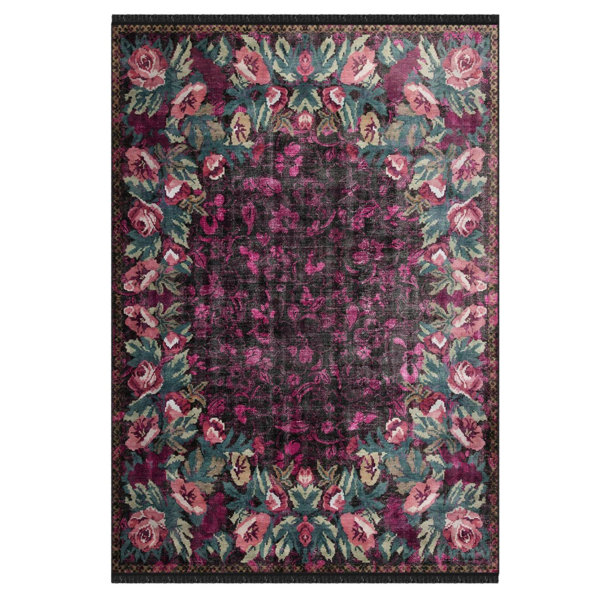
Find the location of a particular element. The image size is (600, 600). pink rose on bottom left corner of the rug is located at coordinates (147, 526).